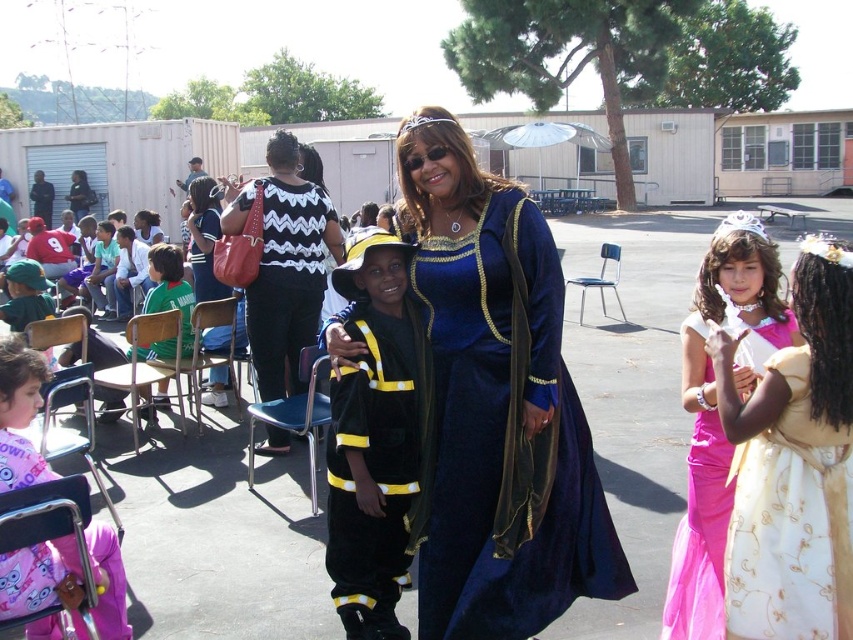
Question: Is velvet blue dress at center positioned before pink satin dress at center?

Choices:
 (A) yes
 (B) no

Answer: (B)

Question: In this image, where is pink satin dress at center located relative to black zigzag sweater at center?

Choices:
 (A) above
 (B) below

Answer: (B)

Question: Among these objects, which one is nearest to the camera?

Choices:
 (A) pink satin dress at center
 (B) velvet blue dress at center

Answer: (A)

Question: Which point appears farthest from the camera in this image?

Choices:
 (A) (47, 570)
 (B) (212, 228)
 (C) (708, 490)

Answer: (B)

Question: Is pink satin dress at center positioned before black zigzag sweater at center?

Choices:
 (A) yes
 (B) no

Answer: (A)

Question: Which object appears closest to the camera in this image?

Choices:
 (A) black zigzag dress at center
 (B) green jersey at left

Answer: (B)